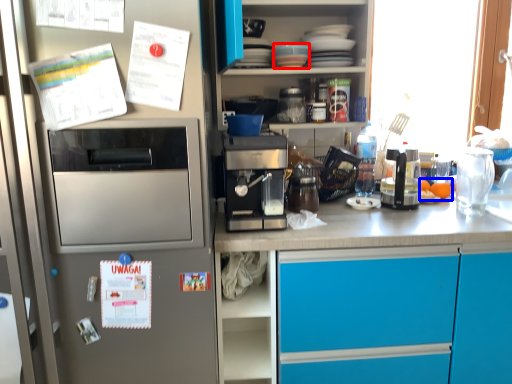
Question: Which object appears closest to the camera in this image, appliance (highlighted by a red box) or food (highlighted by a blue box)?

Choices:
 (A) appliance
 (B) food

Answer: (A)